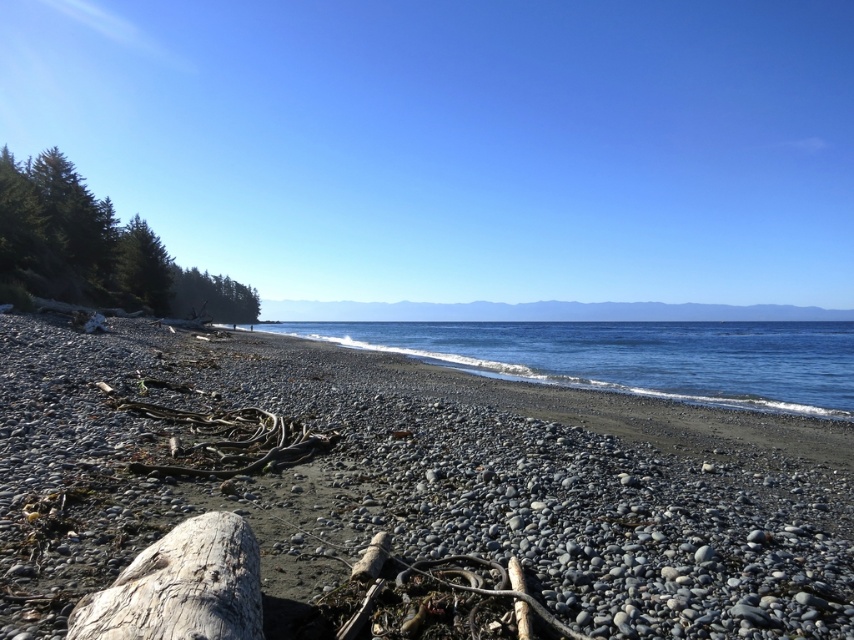
Is gray pebbled beach at center below gray weathered wood log at lower left?

Yes.

You are a GUI agent. You are given a task and a screenshot of the screen. Output one action in this format:
    pyautogui.click(x=<x>, y=<y>)
    Task: Click on the gray pebbled beach at center
    The image size is (854, 640).
    Given the screenshot: What is the action you would take?
    pyautogui.click(x=399, y=492)

Find the location of a particular element. gray pebbled beach at center is located at coordinates pyautogui.click(x=399, y=492).

Between point (16, 268) and point (192, 538), which one is positioned behind?

Point (16, 268)

Between green leafy trees at left and gray weathered wood log at lower left, which one is positioned lower?

Positioned lower is gray weathered wood log at lower left.

Who is more forward, [167,273] or [171,602]?

Point [171,602] is more forward.

Identify the location of green leafy trees at left. (97, 248).

Is blue water at center above green leafy trees at left?

Incorrect, blue water at center is not positioned above green leafy trees at left.

Which is in front, point (330, 326) or point (50, 243)?

Positioned in front is point (50, 243).

Locate an element on the screen. blue water at center is located at coordinates (635, 356).